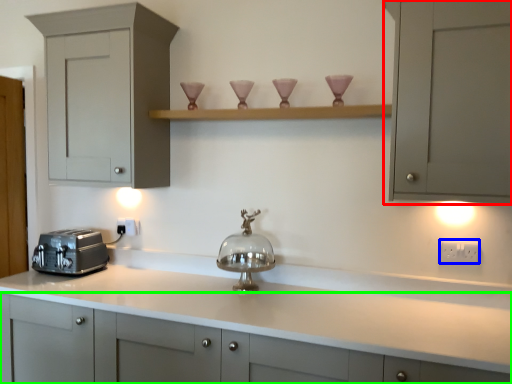
Question: Estimate the real-world distances between objects in this image. Which object is closer to cabinetry (highlighted by a red box), electric outlet (highlighted by a blue box) or cabinetry (highlighted by a green box)?

Choices:
 (A) electric outlet
 (B) cabinetry

Answer: (A)